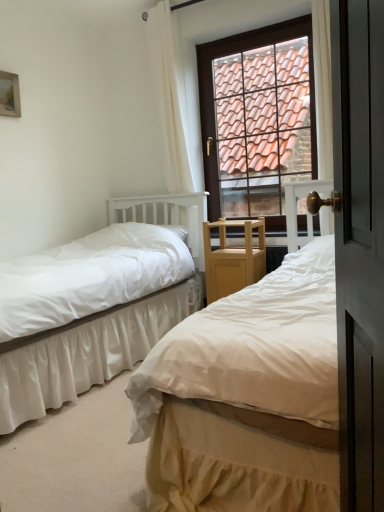
Question: Is wooden picture frame at upper left bigger than white satin bed at center, which is the first bed from left to right?

Choices:
 (A) no
 (B) yes

Answer: (A)

Question: From a real-world perspective, is wooden picture frame at upper left physically above white satin bed at center, which is counted as the second bed, starting from the right?

Choices:
 (A) no
 (B) yes

Answer: (B)

Question: Is wooden picture frame at upper left thinner than white satin bed at center, which is the first bed from left to right?

Choices:
 (A) yes
 (B) no

Answer: (A)

Question: From a real-world perspective, is wooden picture frame at upper left physically below white satin bed at center, which is counted as the second bed, starting from the right?

Choices:
 (A) yes
 (B) no

Answer: (B)

Question: Considering the relative sizes of wooden picture frame at upper left and white satin bed at center, which is counted as the second bed, starting from the right, in the image provided, is wooden picture frame at upper left taller than white satin bed at center, which is counted as the second bed, starting from the right,?

Choices:
 (A) yes
 (B) no

Answer: (B)

Question: From a real-world perspective, is white satin bed at center, which is the first bed from left to right, physically located above or below white cotton bed at center, which ranks as the 2th bed in left-to-right order?

Choices:
 (A) above
 (B) below

Answer: (B)

Question: Is white satin bed at center, which is the first bed from left to right, to the left or to the right of white cotton bed at center, arranged as the 1th bed when viewed from the right, in the image?

Choices:
 (A) left
 (B) right

Answer: (A)

Question: Is point (198, 222) positioned closer to the camera than point (309, 305)?

Choices:
 (A) closer
 (B) farther

Answer: (B)

Question: In terms of width, does white satin bed at center, which is counted as the second bed, starting from the right, look wider or thinner when compared to white cotton bed at center, arranged as the 1th bed when viewed from the right?

Choices:
 (A) wide
 (B) thin

Answer: (B)

Question: In the image, is brown tile roof at upper center on the left side or the right side of wooden picture frame at upper left?

Choices:
 (A) left
 (B) right

Answer: (B)

Question: Relative to wooden picture frame at upper left, is brown tile roof at upper center in front or behind?

Choices:
 (A) behind
 (B) front

Answer: (A)

Question: Considering the positions of brown tile roof at upper center and wooden picture frame at upper left in the image, is brown tile roof at upper center wider or thinner than wooden picture frame at upper left?

Choices:
 (A) wide
 (B) thin

Answer: (A)

Question: Considering the positions of brown tile roof at upper center and wooden picture frame at upper left in the image, is brown tile roof at upper center bigger or smaller than wooden picture frame at upper left?

Choices:
 (A) small
 (B) big

Answer: (B)

Question: Is brown tile roof at upper center taller or shorter than white sheer curtain at upper center?

Choices:
 (A) tall
 (B) short

Answer: (B)

Question: Is point (205, 101) positioned closer to the camera than point (163, 31)?

Choices:
 (A) farther
 (B) closer

Answer: (A)